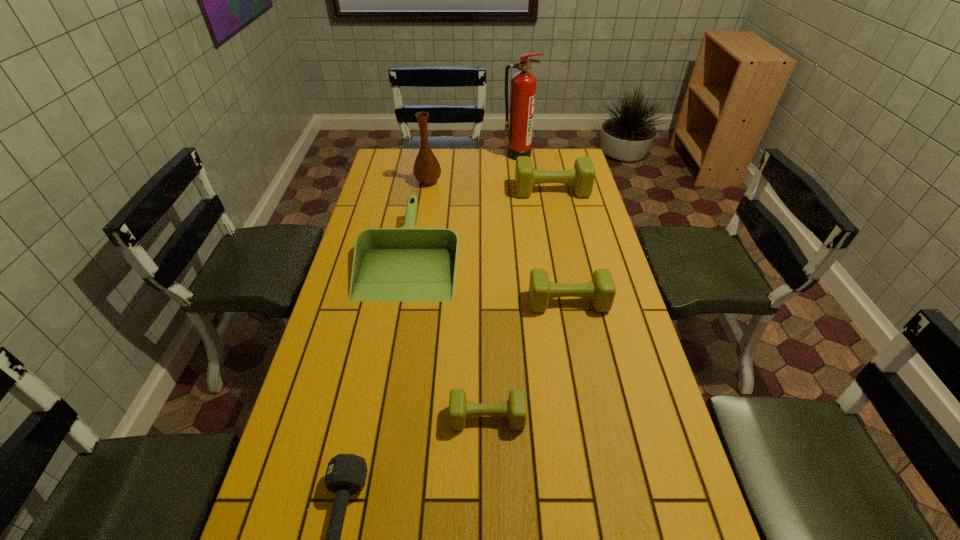
Identify the location of the sixth farthest object. (514, 409).

At what (x,y) coordinates should I click in order to perform the action: click on vacant space located 0.320m with the nozzle pointing from the back of the farthest object. Please return your answer as a coordinate pair (x, y). Looking at the image, I should click on (524, 202).

At what (x,y) coordinates should I click in order to perform the action: click on free space located on the front of the vase. Please return your answer as a coordinate pair (x, y). Looking at the image, I should click on (424, 209).

Locate an element on the screen. The width and height of the screenshot is (960, 540). vacant space located 0.310m on the left of the tallest dumbbell is located at coordinates (440, 191).

Find the location of a particular element. The width and height of the screenshot is (960, 540). free spot located 0.110m on the scoop of the dustpan is located at coordinates (396, 329).

Identify the location of free point located 0.300m on the front of the second farthest olive dumbbell. The image size is (960, 540). (588, 404).

Locate an element on the screen. free region located on the left of the second nearest dumbbell is located at coordinates (365, 418).

Where is `fire extinguisher that is at the far edge`? This screenshot has height=540, width=960. fire extinguisher that is at the far edge is located at coordinates (519, 127).

You are a GUI agent. You are given a task and a screenshot of the screen. Output one action in this format:
    pyautogui.click(x=<x>, y=<y>)
    Task: Click on the vase situated at the far edge
    The width and height of the screenshot is (960, 540).
    Given the screenshot: What is the action you would take?
    pyautogui.click(x=426, y=169)

The width and height of the screenshot is (960, 540). Find the location of `object that is at the left edge`. object that is at the left edge is located at coordinates (408, 264).